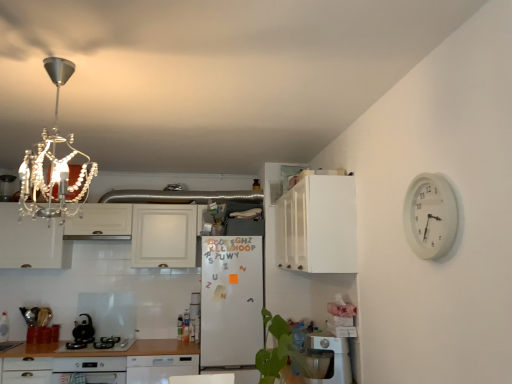
Question: From the image's perspective, would you say white plastic dish washer at lower center, positioned as the second dish washer in back-to-front order, is positioned over white matte cabinet at upper center, arranged as the second cabinetry when viewed from the left?

Choices:
 (A) no
 (B) yes

Answer: (A)

Question: Is white plastic dish washer at lower center, arranged as the first dish washer when viewed from the top, oriented away from white matte cabinet at upper center, which is the first cabinetry in front-to-back order?

Choices:
 (A) no
 (B) yes

Answer: (A)

Question: From the image's perspective, is white plastic dish washer at lower center, arranged as the first dish washer when viewed from the top, under white matte cabinet at upper center, arranged as the second cabinetry when viewed from the left?

Choices:
 (A) yes
 (B) no

Answer: (A)

Question: Can white matte cabinet at upper center, arranged as the 1th cabinetry when viewed from the right, be found inside white plastic dish washer at lower center, which is the first dish washer from right to left?

Choices:
 (A) yes
 (B) no

Answer: (B)

Question: Is white plastic dish washer at lower center, the 2th dish washer positioned from the bottom, shorter than white matte cabinet at upper center, which ranks as the 2th cabinetry in back-to-front order?

Choices:
 (A) no
 (B) yes

Answer: (B)

Question: Is point (423, 225) closer or farther from the camera than point (87, 332)?

Choices:
 (A) farther
 (B) closer

Answer: (B)

Question: In terms of size, does white plastic clock at upper right appear bigger or smaller than black matte kettle at lower left?

Choices:
 (A) small
 (B) big

Answer: (A)

Question: Considering their positions, is white plastic clock at upper right located in front of or behind black matte kettle at lower left?

Choices:
 (A) behind
 (B) front

Answer: (B)

Question: Considering the positions of white plastic clock at upper right and black matte kettle at lower left in the image, is white plastic clock at upper right taller or shorter than black matte kettle at lower left?

Choices:
 (A) tall
 (B) short

Answer: (A)

Question: Looking at the image, does white glossy cabinet at upper left, marked as the second cabinetry in a right-to-left arrangement, seem bigger or smaller compared to white glossy dishwasher at lower center, the first dish washer positioned from the left?

Choices:
 (A) big
 (B) small

Answer: (A)

Question: Considering the positions of white glossy cabinet at upper left, marked as the second cabinetry in a right-to-left arrangement, and white glossy dishwasher at lower center, the first dish washer positioned from the left, in the image, is white glossy cabinet at upper left, marked as the second cabinetry in a right-to-left arrangement, wider or thinner than white glossy dishwasher at lower center, the first dish washer positioned from the left,?

Choices:
 (A) wide
 (B) thin

Answer: (B)

Question: In terms of height, does white glossy cabinet at upper left, the 1th cabinetry from the left, look taller or shorter compared to white glossy dishwasher at lower center, acting as the 2th dish washer starting from the front?

Choices:
 (A) tall
 (B) short

Answer: (A)

Question: From the image's perspective, is white glossy cabinet at upper left, marked as the second cabinetry in a right-to-left arrangement, above or below white glossy dishwasher at lower center, the first dish washer positioned from the left?

Choices:
 (A) below
 (B) above

Answer: (B)

Question: From the image's perspective, is white matte refrigerator at center positioned above or below white glossy dishwasher at lower center, acting as the 2th dish washer starting from the front?

Choices:
 (A) above
 (B) below

Answer: (A)

Question: Is white matte refrigerator at center situated inside white glossy dishwasher at lower center, acting as the 2th dish washer starting from the front, or outside?

Choices:
 (A) inside
 (B) outside

Answer: (B)